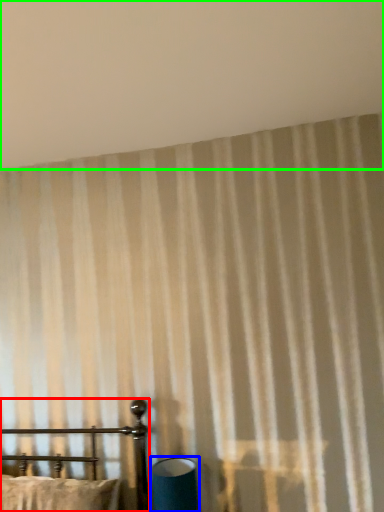
Question: Which object is the farthest from furniture (highlighted by a red box)? Choose among these: table lamp (highlighted by a blue box) or backdrop (highlighted by a green box).

Choices:
 (A) table lamp
 (B) backdrop

Answer: (B)